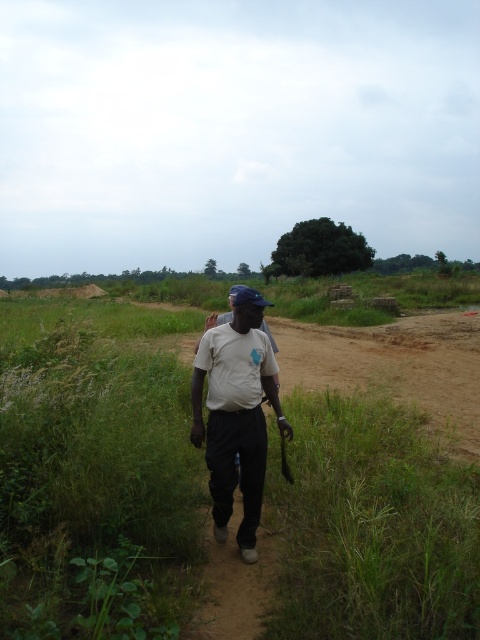
Does green grass at center appear on the left side of dirt path at center?

Indeed, green grass at center is positioned on the left side of dirt path at center.

Which is above, green grass at center or dirt path at center?

green grass at center is above.

The image size is (480, 640). I want to click on green grass at center, so click(x=95, y=476).

You are a GUI agent. You are given a task and a screenshot of the screen. Output one action in this format:
    pyautogui.click(x=<x>, y=<y>)
    Task: Click on the green grass at center
    
    Given the screenshot: What is the action you would take?
    (95, 476)

Can you confirm if white matte shirt at center is wider than dirt path at center?

Indeed, white matte shirt at center has a greater width compared to dirt path at center.

Does white matte shirt at center appear under dirt path at center?

No.

The image size is (480, 640). Identify the location of white matte shirt at center. (237, 413).

Between green grass at center and white matte shirt at center, which one is positioned lower?

white matte shirt at center is lower down.

Between point (168, 326) and point (216, 464), which one is positioned behind?

The point (168, 326) is more distant.

Identify the location of green grass at center. (95, 476).